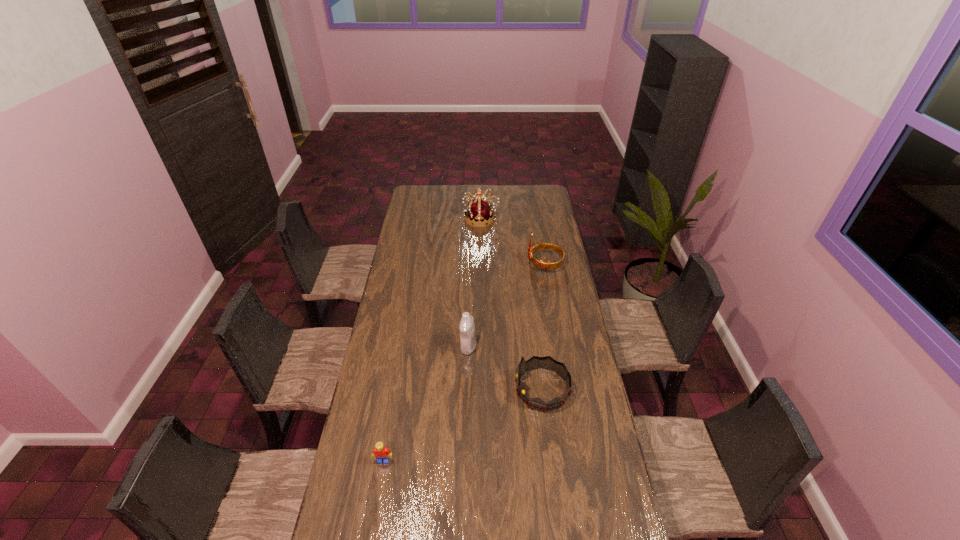
Locate an element on the screen. free location located on the front-facing side of the farthest object is located at coordinates (437, 219).

At what (x,y) coordinates should I click in order to perform the action: click on free region located 0.290m on the front-facing side of the fourth nearest object. Please return your answer as a coordinate pair (x, y). The height and width of the screenshot is (540, 960). Looking at the image, I should click on (471, 264).

At what (x,y) coordinates should I click in order to perform the action: click on vacant space located on the front-facing side of the fourth nearest object. Please return your answer as a coordinate pair (x, y). Looking at the image, I should click on (509, 264).

I want to click on vacant region located on the front-facing side of the fourth nearest object, so click(464, 264).

Where is `vacant position located 0.340m on the front of the third nearest object`? Image resolution: width=960 pixels, height=540 pixels. vacant position located 0.340m on the front of the third nearest object is located at coordinates (467, 429).

You are a GUI agent. You are given a task and a screenshot of the screen. Output one action in this format:
    pyautogui.click(x=<x>, y=<y>)
    Task: Click on the vacant space located at the front of the fourth tallest object with jewels
    This screenshot has height=540, width=960.
    Given the screenshot: What is the action you would take?
    pyautogui.click(x=442, y=389)

This screenshot has height=540, width=960. In order to click on vacant space located 0.350m at the front of the fourth tallest object with jewels in this screenshot , I will do `click(426, 389)`.

Where is `free space located at the front of the fourth tallest object with jewels`? The height and width of the screenshot is (540, 960). free space located at the front of the fourth tallest object with jewels is located at coordinates (457, 389).

The height and width of the screenshot is (540, 960). Find the location of `free space located on the face of the Lego`. free space located on the face of the Lego is located at coordinates (380, 482).

The image size is (960, 540). What are the coordinates of `object situated at the left edge` in the screenshot? It's located at (381, 453).